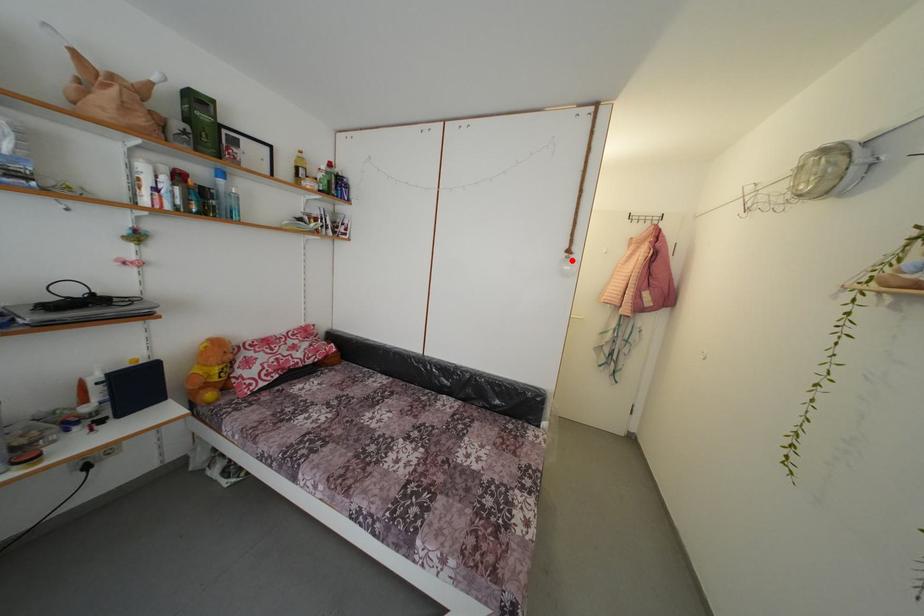
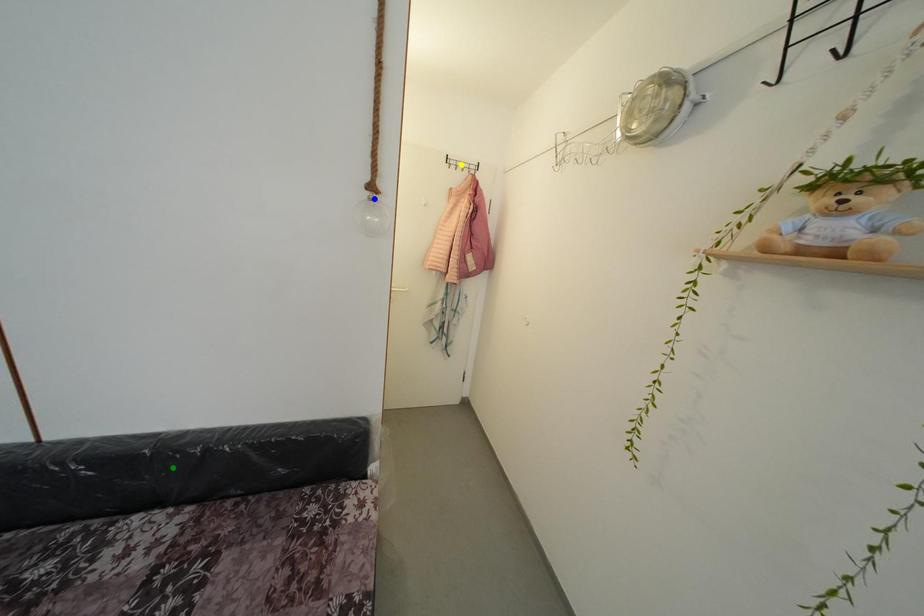
Question: I am providing you with two images of the same scene from different viewpoints. A red point is marked on the first image. You are given multiple points on the second image. In image 2, which mark is for the same physical point as the one in image 1?

Choices:
 (A) green point
 (B) blue point
 (C) yellow point

Answer: (B)